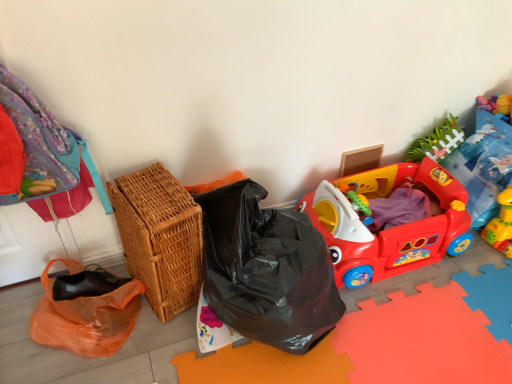
Question: Is point (423, 256) positioned closer to the camera than point (173, 284)?

Choices:
 (A) farther
 (B) closer

Answer: (A)

Question: In terms of width, does rubberized plastic play car at right, which is the second toy from right to left, look wider or thinner when compared to woven brown basket at left?

Choices:
 (A) thin
 (B) wide

Answer: (B)

Question: Considering the real-world distances, which object is farthest from the rubberized plastic play car at right, the first toy when ordered from left to right?

Choices:
 (A) woven brown basket at left
 (B) matte cardboard box at upper right
 (C) yellow rubber duck at lower right, arranged as the first toy when viewed from the right

Answer: (A)

Question: Which of these objects is positioned closest to the matte cardboard box at upper right?

Choices:
 (A) woven brown basket at left
 (B) yellow rubber duck at lower right, the 2th toy from the left
 (C) rubberized plastic play car at right, the first toy when ordered from left to right

Answer: (C)